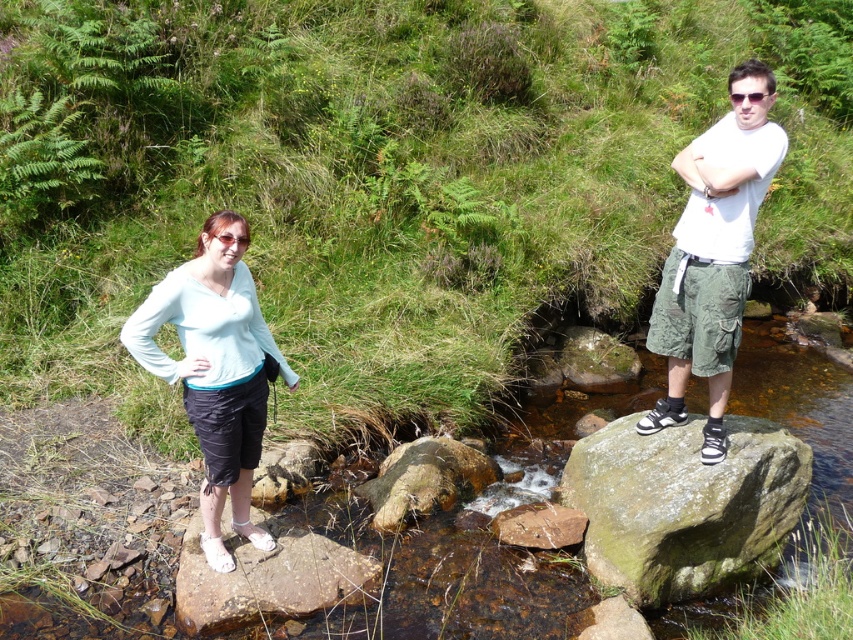
Question: Which is nearer to the white matte skirt at left?

Choices:
 (A) green mossy rock at right
 (B) white matte t-shirt at center

Answer: (A)

Question: Can you confirm if green mossy rock at right is positioned above white matte skirt at left?

Choices:
 (A) yes
 (B) no

Answer: (B)

Question: Can you confirm if green mossy rock at right is thinner than white matte t-shirt at center?

Choices:
 (A) no
 (B) yes

Answer: (A)

Question: Does white matte t-shirt at center appear on the right side of white matte skirt at left?

Choices:
 (A) yes
 (B) no

Answer: (A)

Question: Which point is closer to the camera?

Choices:
 (A) (682, 508)
 (B) (196, 378)
 (C) (740, 140)

Answer: (B)

Question: Which point is closer to the camera taking this photo?

Choices:
 (A) (709, 324)
 (B) (701, 532)

Answer: (A)